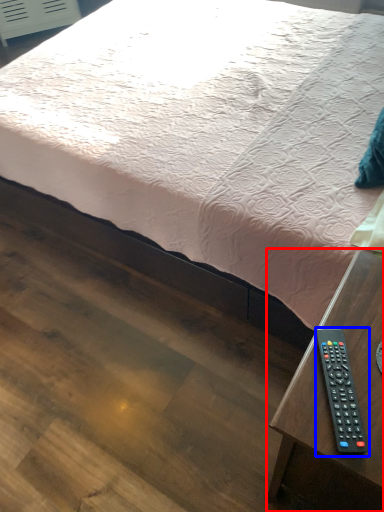
Question: Which object is further to the camera taking this photo, table (highlighted by a red box) or remote control (highlighted by a blue box)?

Choices:
 (A) table
 (B) remote control

Answer: (B)